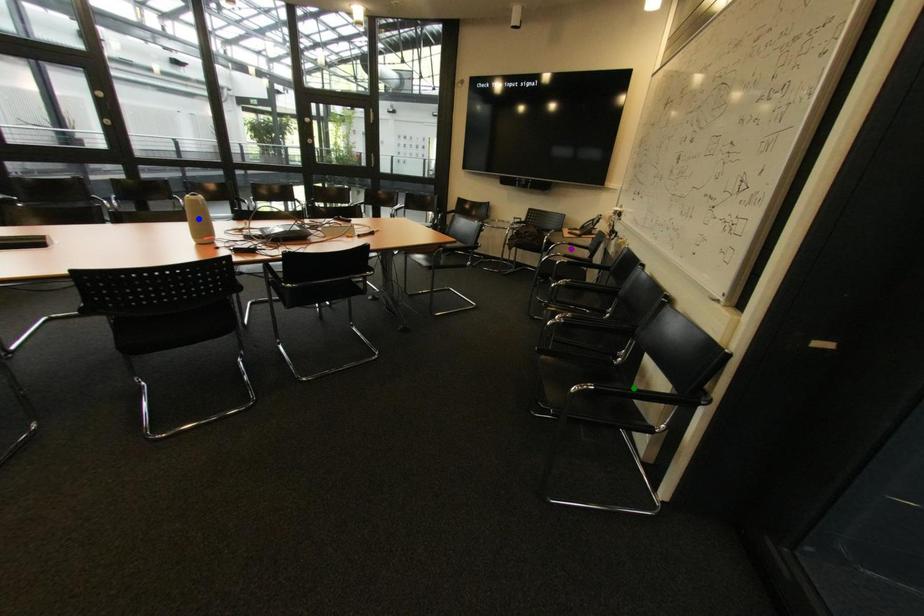
Order these from nearest to farthest:
blue point
purple point
green point

green point, blue point, purple point